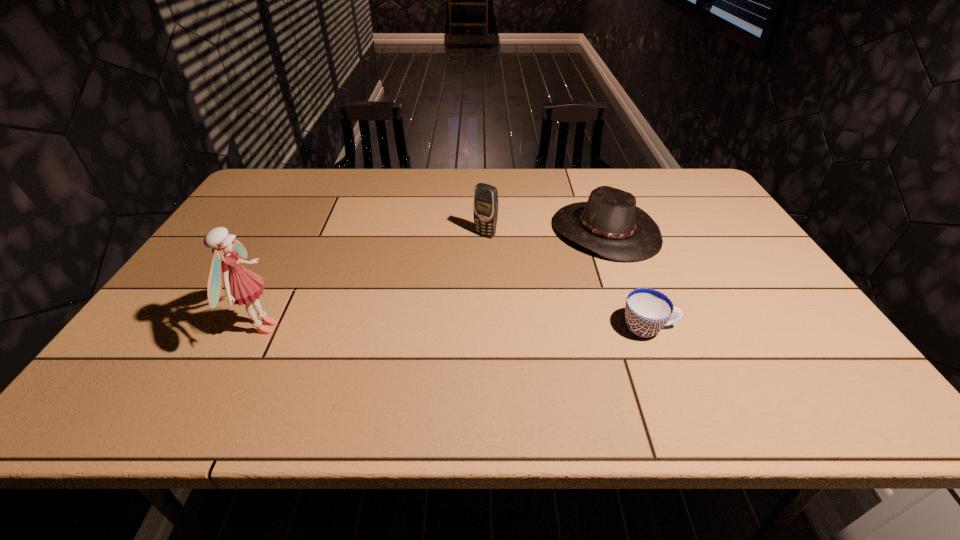
Identify the location of vacant spot on the desktop that is between the leftmost object and the cup and is positioned on the front face of the cellular telephone. The width and height of the screenshot is (960, 540). (401, 328).

At what (x,y) coordinates should I click in order to perform the action: click on vacant space on the desktop that is between the doll and the cup and is positioned on the front-facing side of the hat. Please return your answer as a coordinate pair (x, y). The width and height of the screenshot is (960, 540). Looking at the image, I should click on (492, 328).